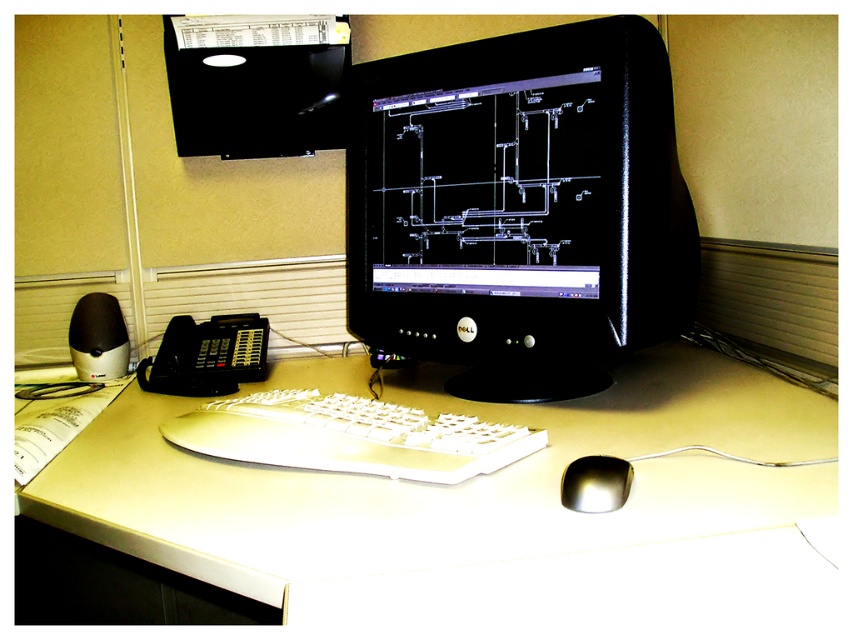
You are standing in front of the workspace shown in the image. You need to reach a point located at coordinates point (260,426). If your arm can extend 80 centimeters, will you be able to reach it?

The point (260,426) is 77.64 centimeters away from the camera. Since your arm can extend 80 centimeters, which is longer than the distance to the point, you will be able to reach it.

You are setting up a new webcam for video calls. The webcam needs to be placed directly above the black glossy monitor at center to ensure the best angle. According to the coordinates provided, where should you position the webcam?

The black glossy monitor at center is located at point (519, 208), so the webcam should be placed directly above this coordinate to achieve the optimal angle for video calls.

You are setting up a new computer setup and want to place a mousepad between the black glossy monitor at center and the white plastic keyboard at center. According to the image, which side of the keyboard should the mousepad be placed on to align with the existing setup?

The black glossy monitor at center is to the right of the white plastic keyboard at center, so the mousepad should be placed to the right of the white plastic keyboard at center to align with the existing setup.